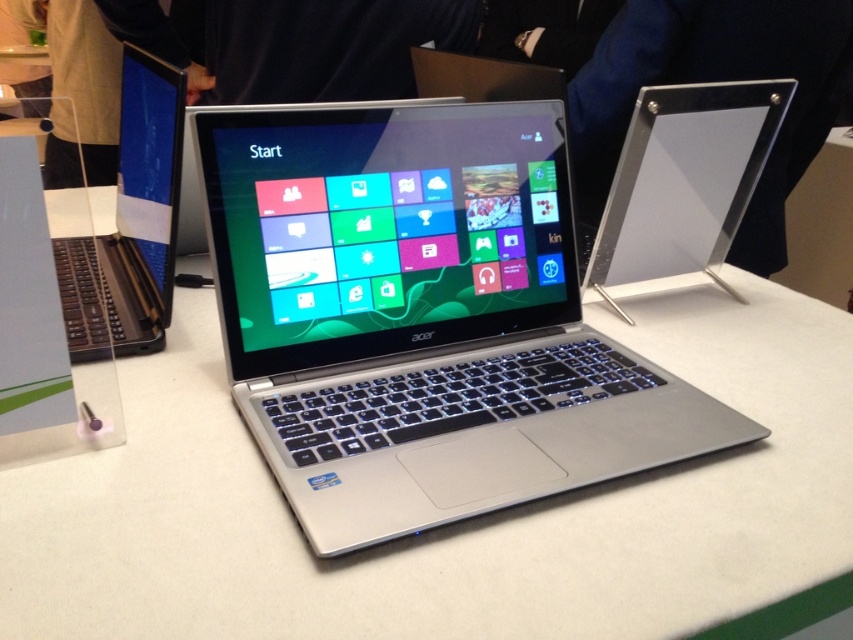
How much distance is there between white matte counter top at center and satin black laptop at left?

white matte counter top at center and satin black laptop at left are 10.69 inches apart.

Is white matte counter top at center below satin black laptop at left?

Yes.

Identify the location of white matte counter top at center. The width and height of the screenshot is (853, 640). (456, 524).

Locate an element on the screen. This screenshot has height=640, width=853. white matte counter top at center is located at coordinates (456, 524).

Does white matte counter top at center have a smaller size compared to silver metallic laptop at center?

No, white matte counter top at center is not smaller than silver metallic laptop at center.

Who is shorter, white matte counter top at center or silver metallic laptop at center?

With less height is white matte counter top at center.

Image resolution: width=853 pixels, height=640 pixels. What do you see at coordinates (456, 524) in the screenshot?
I see `white matte counter top at center` at bounding box center [456, 524].

Locate an element on the screen. This screenshot has width=853, height=640. white matte counter top at center is located at coordinates (456, 524).

Is point (502, 349) less distant than point (151, 296)?

Yes, point (502, 349) is in front of point (151, 296).

Locate an element on the screen. silver metallic laptop at center is located at coordinates (422, 316).